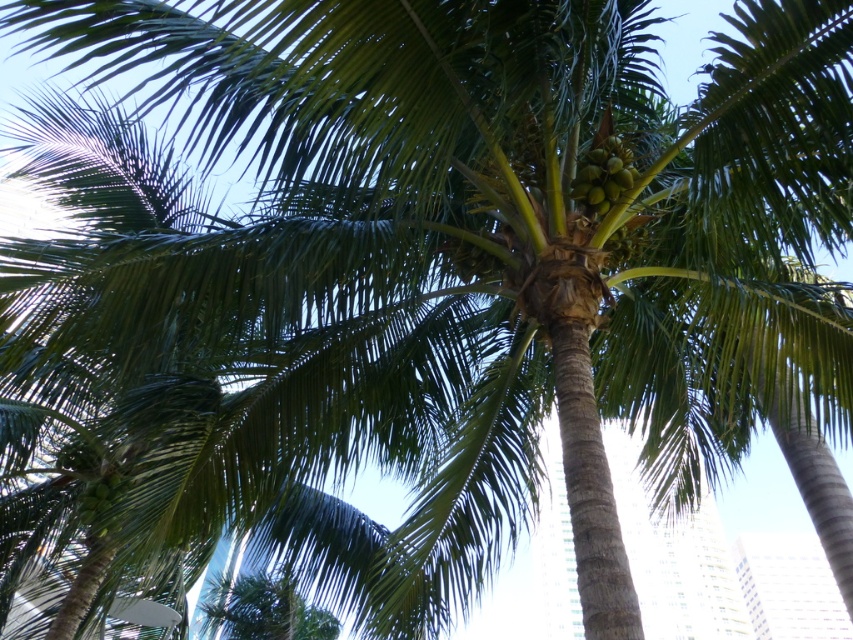
You are a drone operator tasked with capturing aerial footage of the palm tree. The two green matte coconuts at upper center and green matte coconuts at upper left are your focal points. What is the minimum horizontal distance you need to maintain between your drone and each coconut cluster to ensure both are in frame simultaneously?

The minimum horizontal distance required is 5.07 meters, as this is the distance between the green matte coconuts at upper center and green matte coconuts at upper left. By maintaining this distance, both clusters will be captured within the drone camera frame.

You are a botanist examining the palm tree and notice two clusters of green matte coconuts at upper center and green matte coconuts at upper left. Which cluster has coconuts that are smaller in size?

The green matte coconuts at upper center has a smaller size compared to the green matte coconuts at upper left.

You are a botanist examining a palm tree and notice two clusters of green matte coconuts at upper center and green matte coconuts at upper left. Which cluster is located higher up on the tree?

The green matte coconuts at upper center is positioned higher than the green matte coconuts at upper left, so the cluster at upper center is higher on the tree.